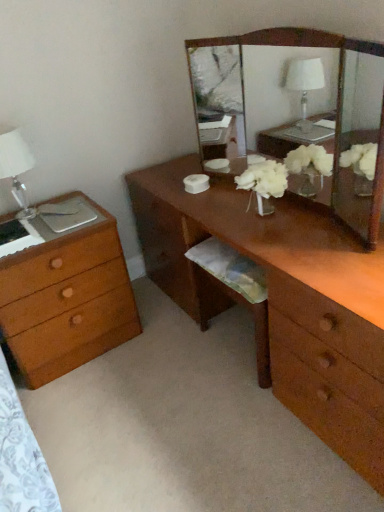
I want to click on free space below wooden mirror at center (from a real-world perspective), so click(x=285, y=208).